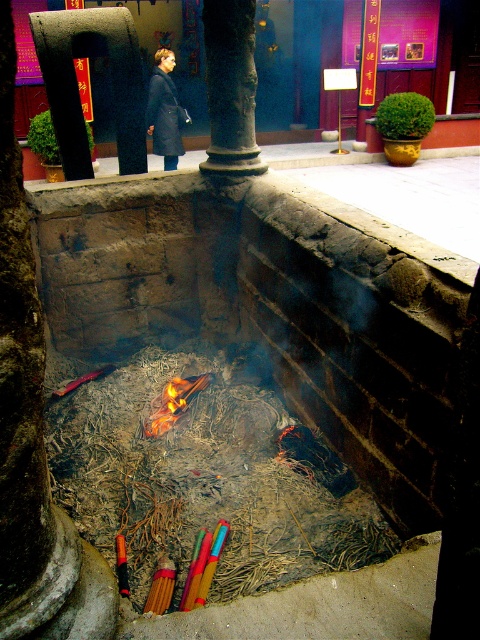
Question: Can you confirm if dark gray stone column at center is thinner than flametransparentfire at center?

Choices:
 (A) no
 (B) yes

Answer: (A)

Question: Can you confirm if dark gray stone column at center is positioned to the right of dark blue coat at center?

Choices:
 (A) yes
 (B) no

Answer: (A)

Question: Can you confirm if dark blue coat at center is positioned to the left of flametransparentfire at center?

Choices:
 (A) no
 (B) yes

Answer: (B)

Question: Among these objects, which one is nearest to the camera?

Choices:
 (A) dark blue coat at center
 (B) flametransparentfire at center
 (C) dark gray stone column at center

Answer: (B)

Question: Which point is closer to the camera?

Choices:
 (A) flametransparentfire at center
 (B) dark blue coat at center

Answer: (A)

Question: Which point is farther from the camera taking this photo?

Choices:
 (A) (151, 435)
 (B) (227, 168)
 (C) (182, 120)

Answer: (C)